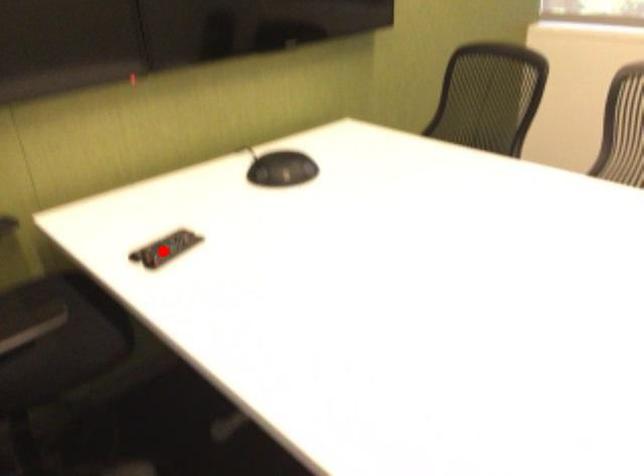
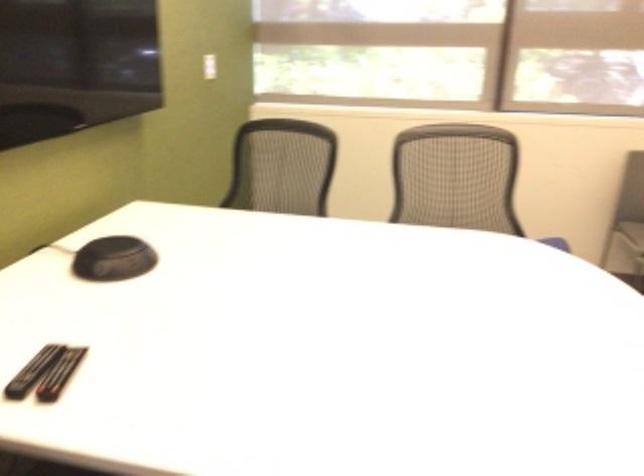
Question: I am providing you with two images of the same scene from different viewpoints. A red point is shown in image1. For the corresponding object point in image2, is it positioned nearer or farther from the camera?

Choices:
 (A) Nearer
 (B) Farther

Answer: (A)